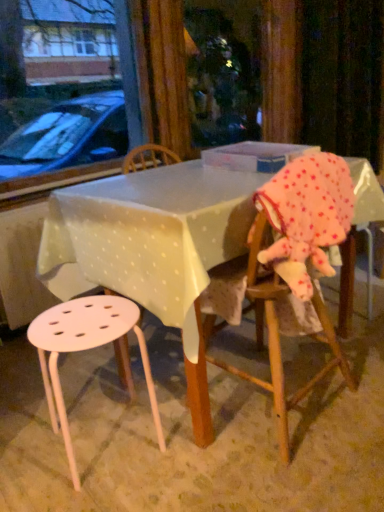
At what (x,y) coordinates should I click in order to perform the action: click on free space on the front side of white plastic stool at lower left. Please return your answer as a coordinate pair (x, y). This screenshot has width=384, height=512. Looking at the image, I should click on (103, 493).